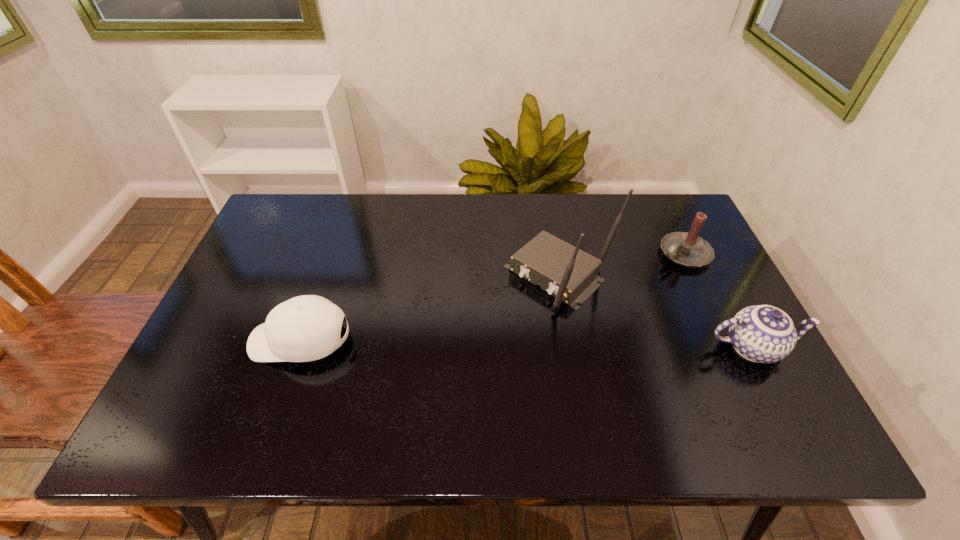
Where is `vacant space on the desktop that is between the baseball cap and the chinaware and is positioned on the side of the candle with the handle loop`? This screenshot has width=960, height=540. vacant space on the desktop that is between the baseball cap and the chinaware and is positioned on the side of the candle with the handle loop is located at coordinates (523, 344).

At what (x,y) coordinates should I click in order to perform the action: click on free space on the desktop that is between the leftmost object and the chinaware and is positioned on the back of the router to connect cables. Please return your answer as a coordinate pair (x, y). Looking at the image, I should click on (488, 343).